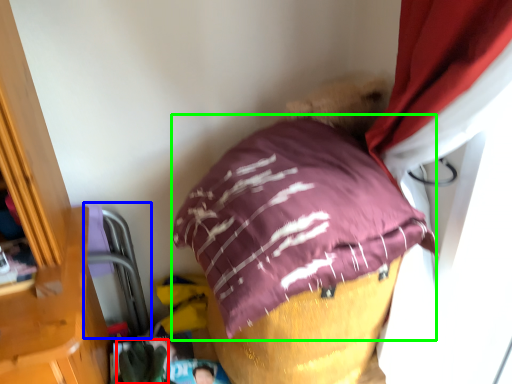
Question: Estimate the real-world distances between objects in this image. Which object is farther from clothing (highlighted by a red box), bean bag chair (highlighted by a blue box) or pillow (highlighted by a green box)?

Choices:
 (A) bean bag chair
 (B) pillow

Answer: (B)